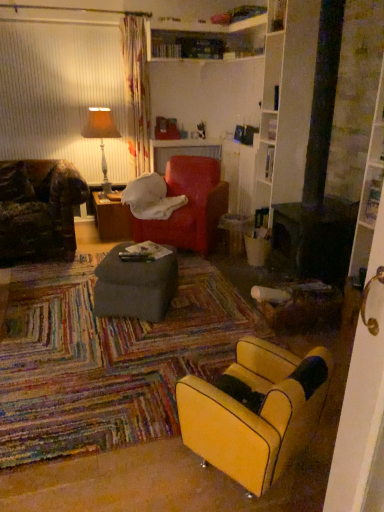
Question: Is yellow leather chair at lower right wider than matte gray ottoman at center, the first table viewed from the front?

Choices:
 (A) no
 (B) yes

Answer: (A)

Question: Is yellow leather chair at lower right positioned in front of matte gray ottoman at center, which appears as the second table when viewed from the top?

Choices:
 (A) no
 (B) yes

Answer: (B)

Question: Can you confirm if yellow leather chair at lower right is positioned to the right of matte gray ottoman at center, the first table viewed from the front?

Choices:
 (A) no
 (B) yes

Answer: (B)

Question: From the image's perspective, would you say yellow leather chair at lower right is positioned over matte gray ottoman at center, the 1th table from the bottom?

Choices:
 (A) no
 (B) yes

Answer: (A)

Question: Is yellow leather chair at lower right thinner than matte gray ottoman at center, acting as the 2th table starting from the left?

Choices:
 (A) no
 (B) yes

Answer: (B)

Question: Is yellow leather chair at lower right further to camera compared to matte gray ottoman at center, the first table viewed from the front?

Choices:
 (A) yes
 (B) no

Answer: (B)

Question: From a real-world perspective, does orange fabric lampshade at upper left sit lower than velvet red bean bag chair at center?

Choices:
 (A) yes
 (B) no

Answer: (B)

Question: Can velvet red bean bag chair at center be found inside orange fabric lampshade at upper left?

Choices:
 (A) yes
 (B) no

Answer: (B)

Question: From the image's perspective, is orange fabric lampshade at upper left over velvet red bean bag chair at center?

Choices:
 (A) no
 (B) yes

Answer: (B)

Question: From a real-world perspective, does orange fabric lampshade at upper left stand above velvet red bean bag chair at center?

Choices:
 (A) no
 (B) yes

Answer: (B)

Question: Considering the relative positions of orange fabric lampshade at upper left and velvet red bean bag chair at center in the image provided, is orange fabric lampshade at upper left to the left of velvet red bean bag chair at center from the viewer's perspective?

Choices:
 (A) no
 (B) yes

Answer: (B)

Question: Is orange fabric lampshade at upper left at the right side of velvet red bean bag chair at center?

Choices:
 (A) no
 (B) yes

Answer: (A)

Question: Is matte gray ottoman at center, the 2th table in the back-to-front sequence, completely or partially inside velvet red bean bag chair at center?

Choices:
 (A) no
 (B) yes

Answer: (A)